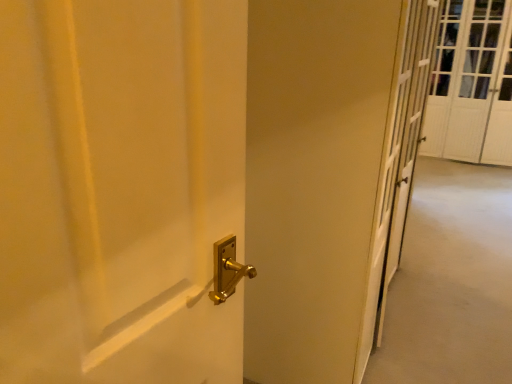
Question: Should I look upward or downward to see gold metallic door handle at center?

Choices:
 (A) up
 (B) down

Answer: (B)

Question: Considering the relative sizes of white textured screen door at upper right and gold metallic door handle at center in the image provided, is white textured screen door at upper right shorter than gold metallic door handle at center?

Choices:
 (A) no
 (B) yes

Answer: (A)

Question: Is white textured screen door at upper right facing away from gold metallic door handle at center?

Choices:
 (A) yes
 (B) no

Answer: (B)

Question: Can you confirm if white textured screen door at upper right is thinner than gold metallic door handle at center?

Choices:
 (A) yes
 (B) no

Answer: (A)

Question: Does white textured screen door at upper right lie in front of gold metallic door handle at center?

Choices:
 (A) no
 (B) yes

Answer: (A)

Question: Considering the relative sizes of white textured screen door at upper right and gold metallic door handle at center in the image provided, is white textured screen door at upper right bigger than gold metallic door handle at center?

Choices:
 (A) no
 (B) yes

Answer: (B)

Question: From the image's perspective, is white textured screen door at upper right located beneath gold metallic door handle at center?

Choices:
 (A) yes
 (B) no

Answer: (B)

Question: Is gold metallic door handle at center at the left side of white textured screen door at upper right?

Choices:
 (A) no
 (B) yes

Answer: (B)

Question: Is gold metallic door handle at center smaller than white textured screen door at upper right?

Choices:
 (A) yes
 (B) no

Answer: (A)

Question: From the image's perspective, is gold metallic door handle at center located beneath white textured screen door at upper right?

Choices:
 (A) no
 (B) yes

Answer: (B)

Question: Is gold metallic door handle at center closer to camera compared to white textured screen door at upper right?

Choices:
 (A) no
 (B) yes

Answer: (B)

Question: Is gold metallic door handle at center further to camera compared to white textured screen door at upper right?

Choices:
 (A) yes
 (B) no

Answer: (B)

Question: Could white textured screen door at upper right be considered to be inside gold metallic door handle at center?

Choices:
 (A) yes
 (B) no

Answer: (B)

Question: Considering the positions of white textured screen door at upper right and gold metallic door handle at center in the image, is white textured screen door at upper right taller or shorter than gold metallic door handle at center?

Choices:
 (A) short
 (B) tall

Answer: (B)